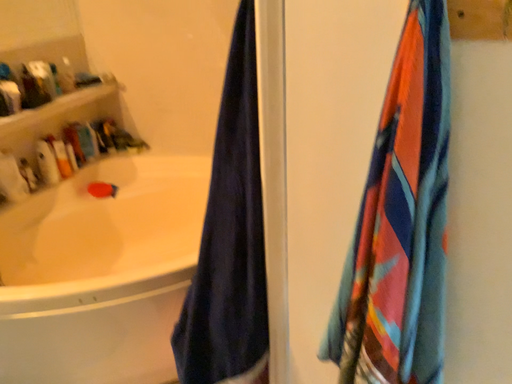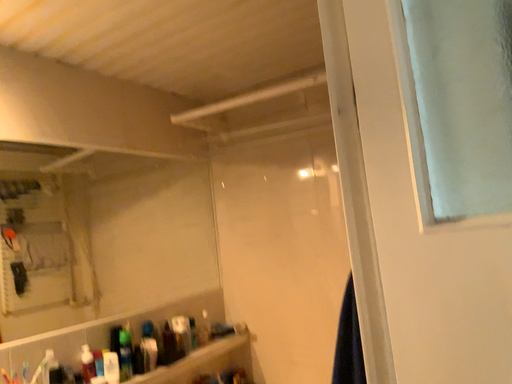
Question: How did the camera likely rotate when shooting the video?

Choices:
 (A) rotated left
 (B) rotated right

Answer: (A)